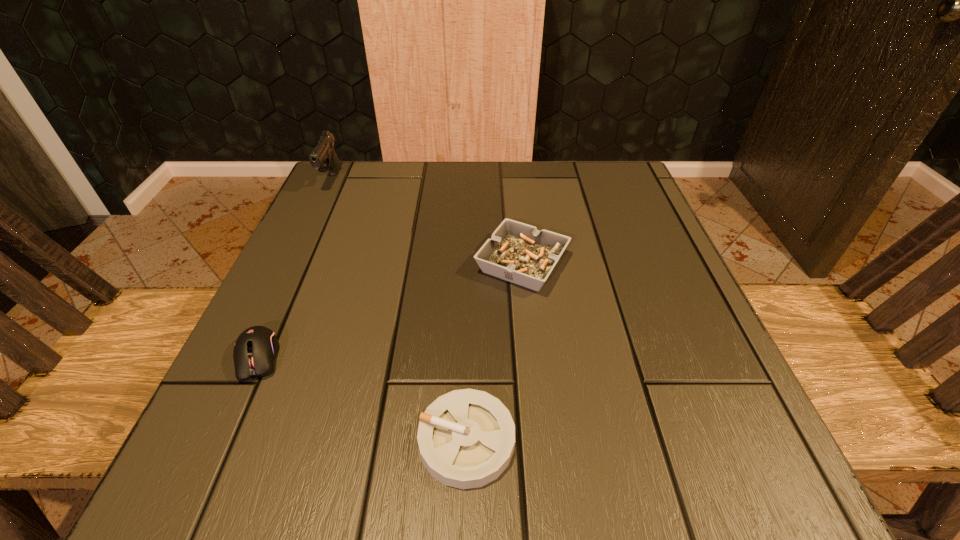
Locate an element on the screen. Image resolution: width=960 pixels, height=540 pixels. vacant position located 0.350m on the back of the nearer ashtray is located at coordinates (471, 243).

Where is `object positioned at the far edge`? The height and width of the screenshot is (540, 960). object positioned at the far edge is located at coordinates (323, 157).

This screenshot has width=960, height=540. I want to click on object situated at the near edge, so click(x=466, y=438).

Identify the location of pistol that is positioned at the left edge. This screenshot has width=960, height=540. (x=323, y=157).

Locate an element on the screen. The height and width of the screenshot is (540, 960). computer mouse that is positioned at the left edge is located at coordinates (255, 349).

Identify the location of object located in the far left corner section of the desktop. (323, 157).

The image size is (960, 540). In the image, there is a desktop. In order to click on vacant space at the far edge in this screenshot , I will do `click(525, 186)`.

This screenshot has height=540, width=960. In the image, there is a desktop. What are the coordinates of `free space at the near edge` in the screenshot? It's located at (362, 447).

You are a GUI agent. You are given a task and a screenshot of the screen. Output one action in this format:
    pyautogui.click(x=<x>, y=<y>)
    Task: Click on the vacant point at the left edge
    
    Given the screenshot: What is the action you would take?
    pyautogui.click(x=235, y=424)

This screenshot has height=540, width=960. What are the coordinates of `free location at the right edge` in the screenshot? It's located at (656, 241).